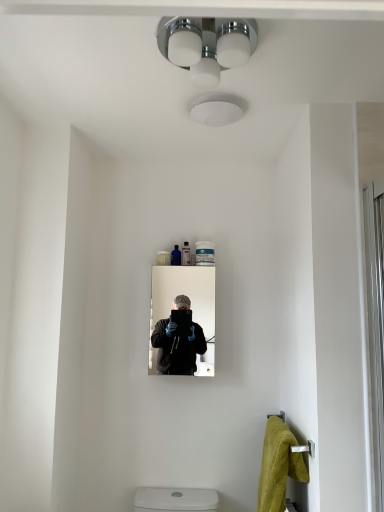
Question: Is yellow plush towel at lower right in front of translucent plastic tube at center, the first toiletry from the right?

Choices:
 (A) yes
 (B) no

Answer: (A)

Question: Could you tell me if yellow plush towel at lower right is facing translucent plastic tube at center, the first toiletry from the right?

Choices:
 (A) yes
 (B) no

Answer: (B)

Question: From a real-world perspective, is yellow plush towel at lower right on top of translucent plastic tube at center, which is the second toiletry from left to right?

Choices:
 (A) no
 (B) yes

Answer: (A)

Question: Is yellow plush towel at lower right at the right side of translucent plastic tube at center, the first toiletry from the right?

Choices:
 (A) yes
 (B) no

Answer: (A)

Question: Considering the relative sizes of yellow plush towel at lower right and translucent plastic tube at center, the first toiletry from the right, in the image provided, is yellow plush towel at lower right smaller than translucent plastic tube at center, the first toiletry from the right,?

Choices:
 (A) yes
 (B) no

Answer: (B)

Question: Considering their positions, is matte black mirror at center located in front of or behind translucent plastic tube at center, which is the second toiletry from left to right?

Choices:
 (A) front
 (B) behind

Answer: (A)

Question: From the image's perspective, relative to translucent plastic tube at center, the first toiletry from the right, is matte black mirror at center above or below?

Choices:
 (A) above
 (B) below

Answer: (B)

Question: Visually, is matte black mirror at center positioned to the left or to the right of translucent plastic tube at center, the first toiletry from the right?

Choices:
 (A) right
 (B) left

Answer: (B)

Question: Looking at the image, does matte black mirror at center seem bigger or smaller compared to translucent plastic tube at center, which is the second toiletry from left to right?

Choices:
 (A) small
 (B) big

Answer: (B)

Question: From their relative heights in the image, would you say white glossy screen door at right is taller or shorter than translucent blue bottle at upper center, which appears as the 1th toiletry when viewed from the left?

Choices:
 (A) tall
 (B) short

Answer: (A)

Question: Is point (379, 327) closer or farther from the camera than point (172, 260)?

Choices:
 (A) farther
 (B) closer

Answer: (B)

Question: From a real-world perspective, is white glossy screen door at right positioned above or below translucent blue bottle at upper center, the 2th toiletry positioned from the right?

Choices:
 (A) above
 (B) below

Answer: (B)

Question: Considering their positions, is white glossy screen door at right located in front of or behind translucent blue bottle at upper center, the 2th toiletry positioned from the right?

Choices:
 (A) behind
 (B) front

Answer: (B)

Question: In terms of width, does yellow plush towel at lower right look wider or thinner when compared to white glossy screen door at right?

Choices:
 (A) wide
 (B) thin

Answer: (A)

Question: Considering the positions of yellow plush towel at lower right and white glossy screen door at right in the image, is yellow plush towel at lower right bigger or smaller than white glossy screen door at right?

Choices:
 (A) small
 (B) big

Answer: (B)